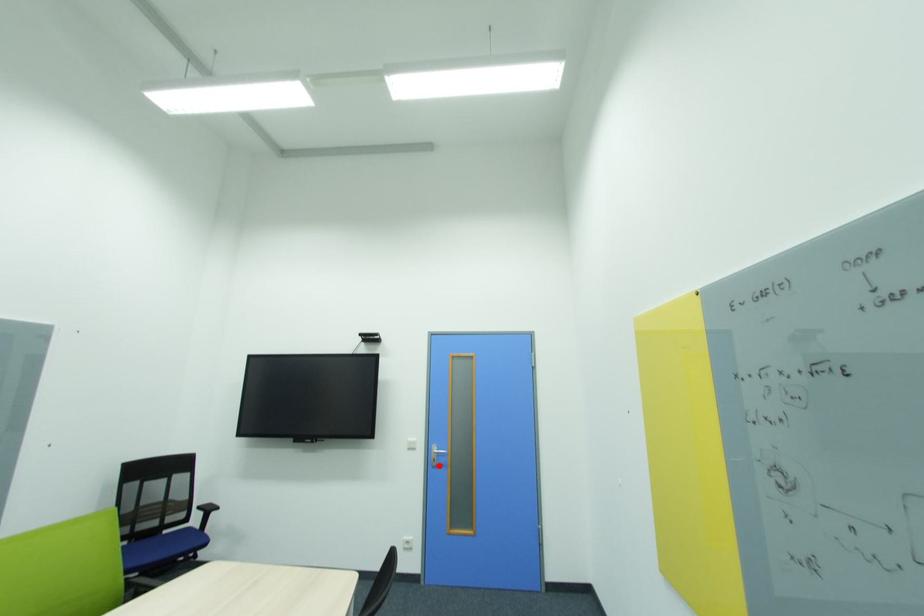
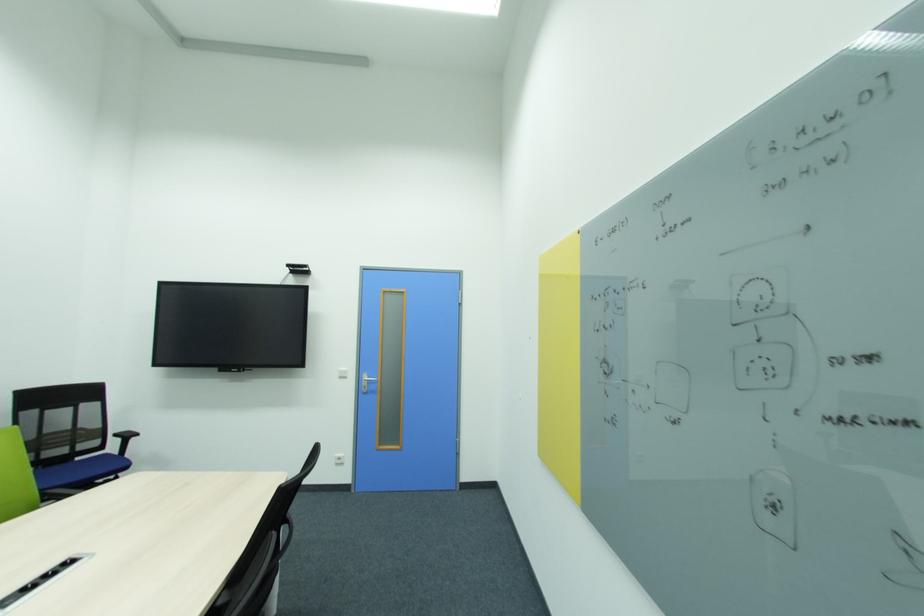
In the second image, find the point that corresponds to the highlighted location in the first image.

(370, 392)